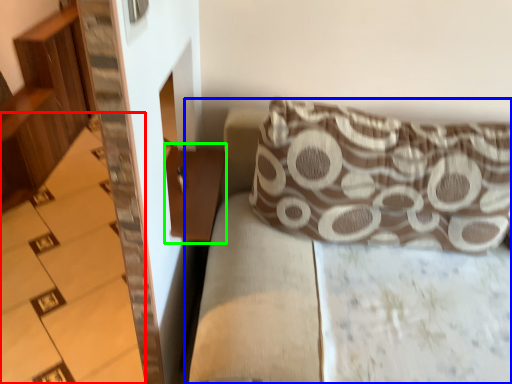
Question: Based on their relative distances, which object is nearer to stairwell (highlighted by a red box)? Choose from couch (highlighted by a blue box) and table (highlighted by a green box).

Choices:
 (A) couch
 (B) table

Answer: (B)